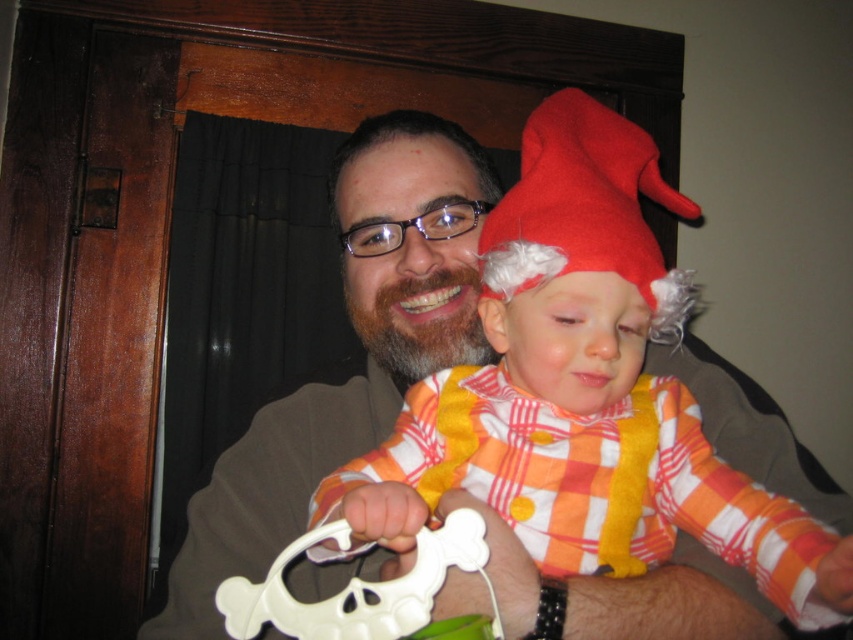
Question: Estimate the real-world distances between objects in this image. Which object is farther from the matte brown suit at center?

Choices:
 (A) white plastic skull at center
 (B) red felt gnome hat at upper center

Answer: (A)

Question: Does matte brown suit at center appear under white plastic skull at center?

Choices:
 (A) yes
 (B) no

Answer: (B)

Question: Is matte brown suit at center to the left of red felt gnome hat at upper center from the viewer's perspective?

Choices:
 (A) no
 (B) yes

Answer: (B)

Question: Which point is farther to the camera?

Choices:
 (A) matte brown suit at center
 (B) white plastic skull at center
 (C) red felt gnome hat at upper center

Answer: (A)

Question: Is matte brown suit at center above white plastic skull at center?

Choices:
 (A) no
 (B) yes

Answer: (B)

Question: Which of the following is the closest to the observer?

Choices:
 (A) (369, 612)
 (B) (525, 593)

Answer: (A)